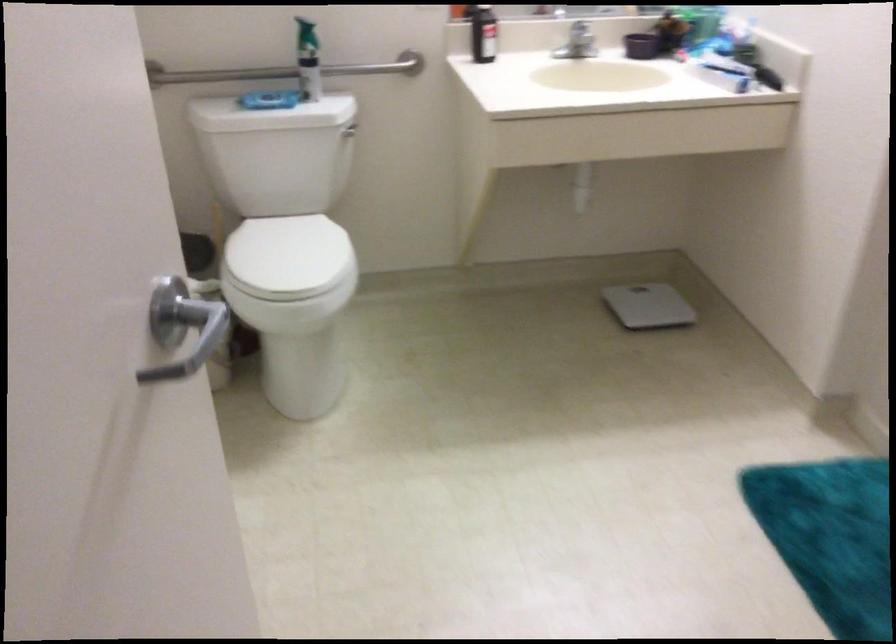
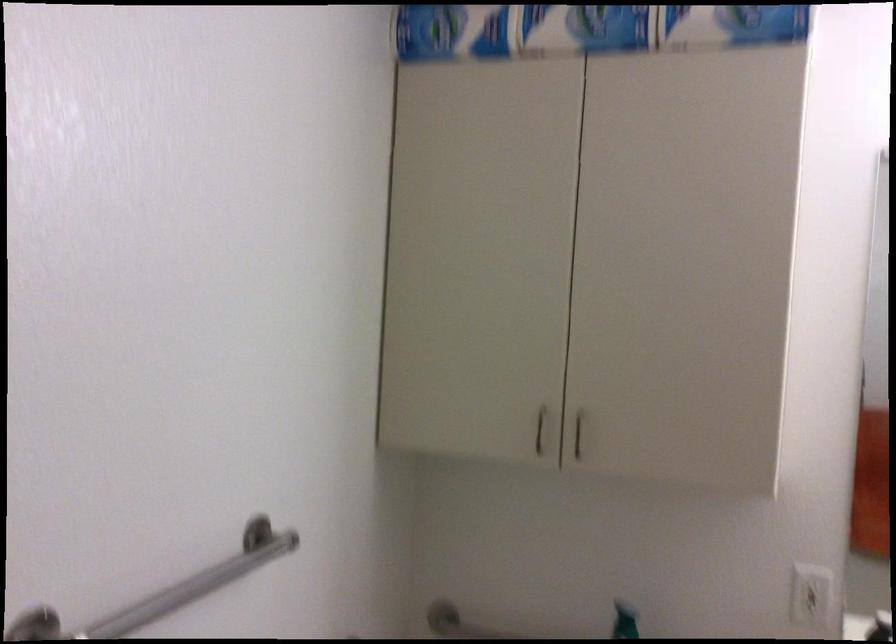
The first image is from the beginning of the video and the second image is from the end. How did the camera likely rotate when shooting the video?

The camera's rotation is toward left-up.